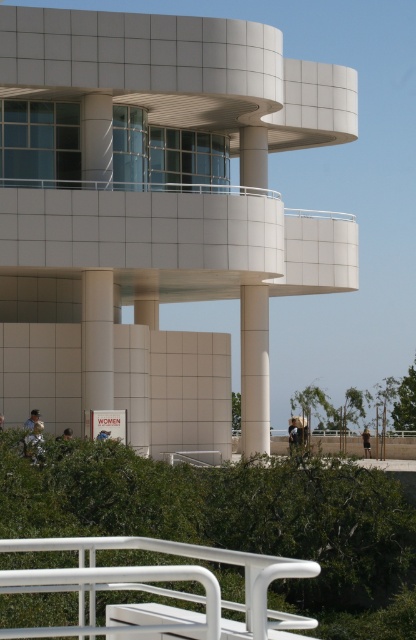
Question: Is dark brown fur at lower center to the left of brown fabric shirt at center from the viewer's perspective?

Choices:
 (A) no
 (B) yes

Answer: (B)

Question: Which object is the closest to the light blue jeans at lower left?

Choices:
 (A) light brown wooden sign at lower left
 (B) white smooth column at center
 (C) dark brown fur at lower center
 (D) white matte rail at lower center

Answer: (A)

Question: Which object appears farthest from the camera in this image?

Choices:
 (A) white smooth column at center
 (B) white matte rail at lower center

Answer: (A)

Question: Is white matte rail at lower center positioned at the back of white smooth column at center?

Choices:
 (A) yes
 (B) no

Answer: (B)

Question: Considering the real-world distances, which object is farthest from the light brown leather jacket at lower left?

Choices:
 (A) white smooth column at center
 (B) dark brown fur at lower center
 (C) white smooth pillar at center

Answer: (B)

Question: Does light blue jeans at lower left appear on the left side of brown fabric shirt at center?

Choices:
 (A) no
 (B) yes

Answer: (B)